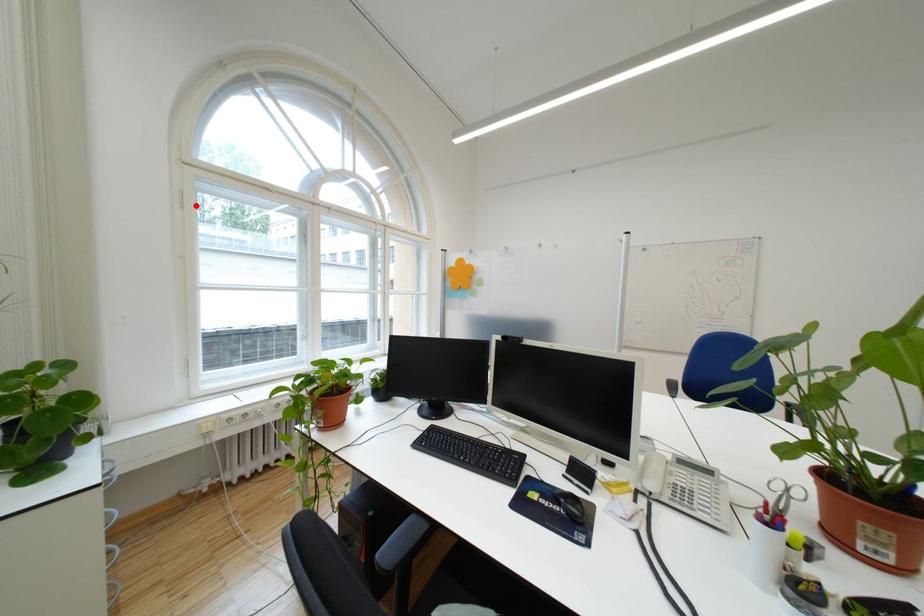
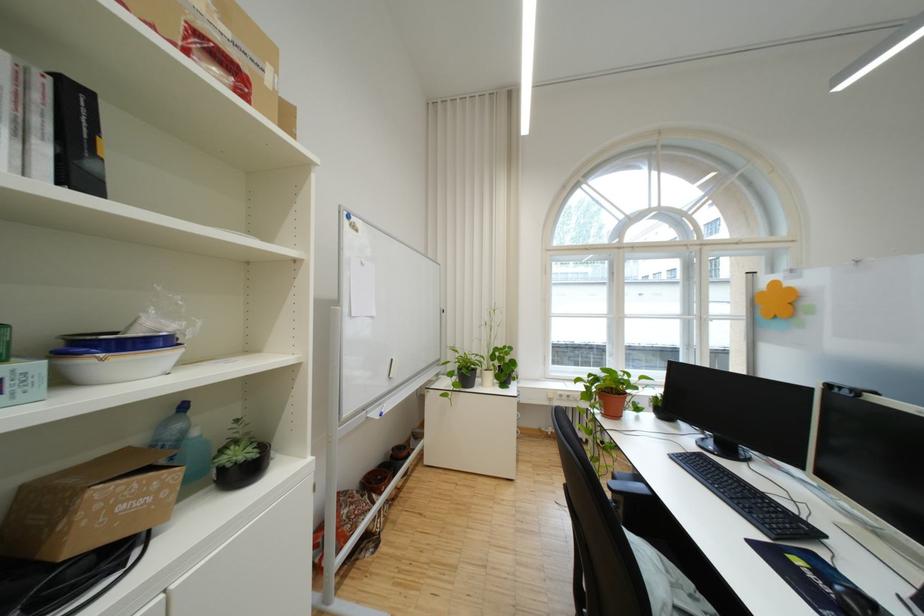
Question: I am providing you with two images of the same scene from different viewpoints. A red point is marked on the first image. At the location where the point appears in image 1, is it still visible in image 2?

Choices:
 (A) Yes
 (B) No

Answer: (A)